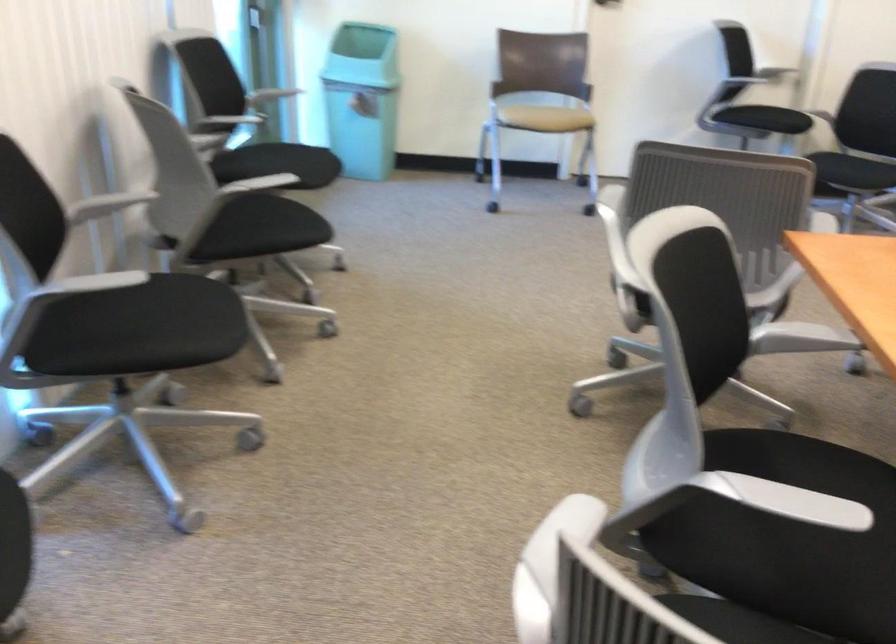
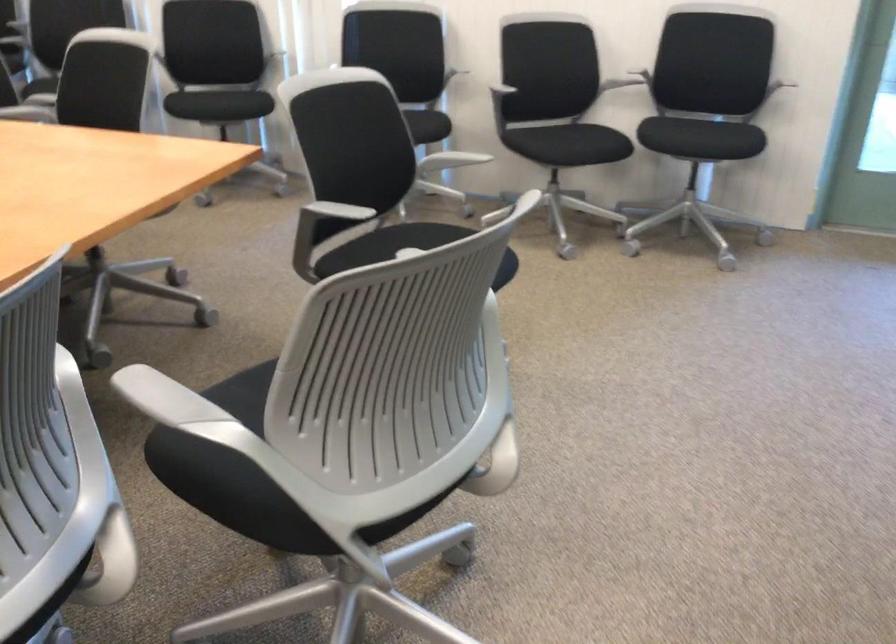
Find the pixel in the second image that matches (170,305) in the first image.

(426, 126)